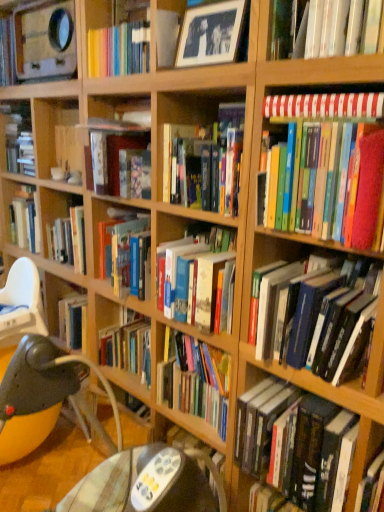
Question: Is hardcover books at center in front of or behind hardcover book at center, the 7th book positioned from the top, in the image?

Choices:
 (A) behind
 (B) front

Answer: (A)

Question: Considering the positions of hardcover books at center and hardcover book at center, the 7th book positioned from the top, in the image, is hardcover books at center wider or thinner than hardcover book at center, the 7th book positioned from the top,?

Choices:
 (A) thin
 (B) wide

Answer: (A)

Question: Which of these objects is positioned closest to the multicolored hardcover books at right, acting as the third book starting from the bottom?

Choices:
 (A) black glossy picture frame at upper center
 (B) plastic highchair at lower left
 (C) yellow fabric bean bag chair at lower left
 (D) hardcover book at upper left, positioned as the 1th book in top-to-bottom order
 (E) red striped fabric at upper right, which ranks as the 3th book in top-to-bottom order

Answer: (E)

Question: Which is nearer to the plastic highchair at lower left?

Choices:
 (A) hardcover books at right, the second book ordered from the bottom
 (B) hardcover books at center
 (C) hardcover book at upper right, which appears as the 6th book when ordered from the bottom
 (D) black glossy picture frame at upper center
 (E) yellow fabric bean bag chair at lower left

Answer: (B)